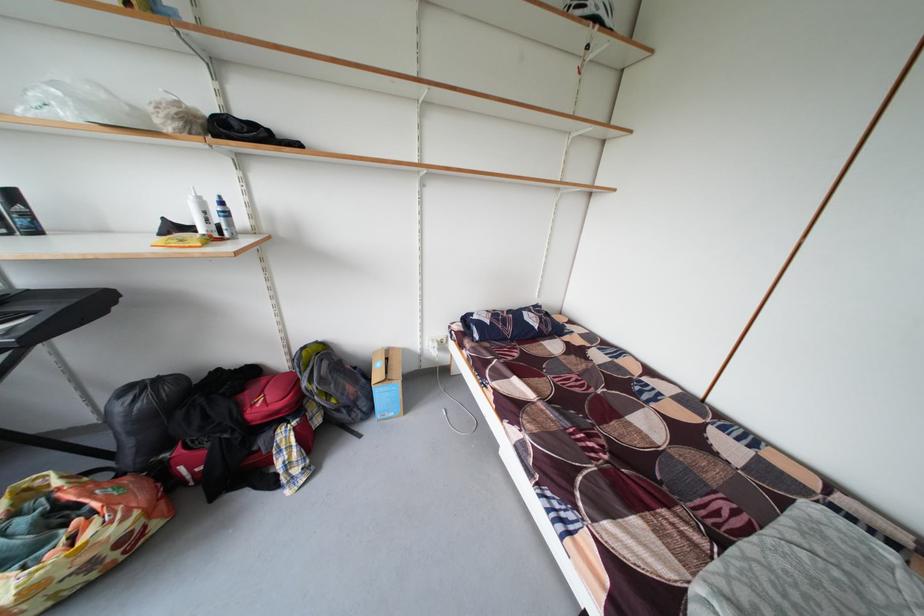
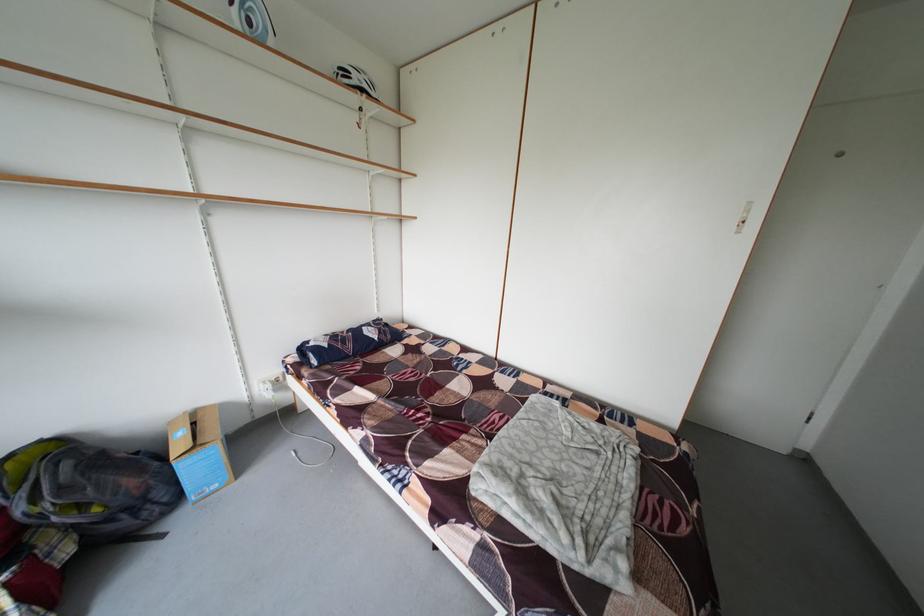
Locate, in the second image, the point that corresponds to point 520,334 in the first image.

(360, 351)